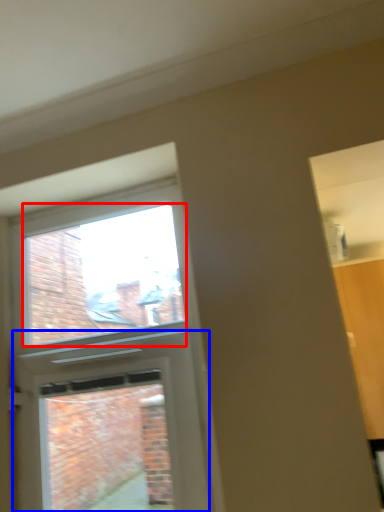
Question: Among these objects, which one is farthest to the camera, window screen (highlighted by a red box) or screen door (highlighted by a blue box)?

Choices:
 (A) window screen
 (B) screen door

Answer: (A)